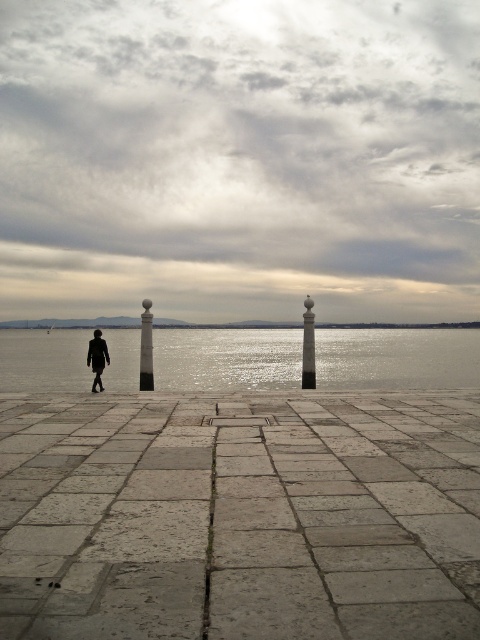
Is reflective silver water at center to the right of smooth black pillar at center from the viewer's perspective?

Yes, reflective silver water at center is to the right of smooth black pillar at center.

Is reflective silver water at center shorter than smooth black pillar at center?

Incorrect, reflective silver water at center's height does not fall short of smooth black pillar at center's.

This screenshot has width=480, height=640. Identify the location of reflective silver water at center. (396, 356).

Who is more forward, (139,504) or (60,337)?

Point (139,504) is in front.

Is gray stone dock at center closer to camera compared to reflective silver water at center?

Yes, it is in front of reflective silver water at center.

Does point (236, 636) come closer to viewer compared to point (411, 355)?

Yes, it is in front of point (411, 355).

Find the location of a particular element. gray stone dock at center is located at coordinates (240, 515).

Is point (147, 385) positioned behind point (310, 380)?

No, (147, 385) is closer to viewer.

Can you confirm if smooth black pillar at center is wider than polished stone pillar at center?

Correct, the width of smooth black pillar at center exceeds that of polished stone pillar at center.

Between point (145, 328) and point (312, 301), which one is positioned behind?

The point (312, 301) is more distant.

This screenshot has height=640, width=480. I want to click on smooth black pillar at center, so click(x=145, y=348).